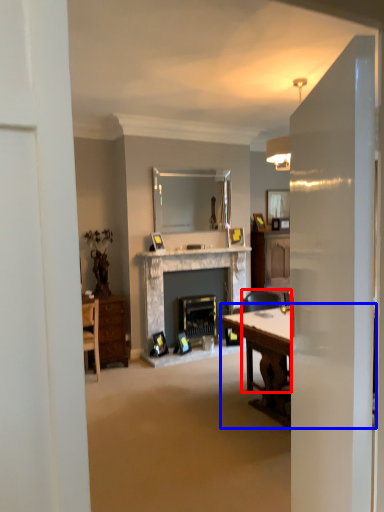
Question: Among these objects, which one is nearest to the camera, chair (highlighted by a red box) or table (highlighted by a blue box)?

Choices:
 (A) chair
 (B) table

Answer: (B)